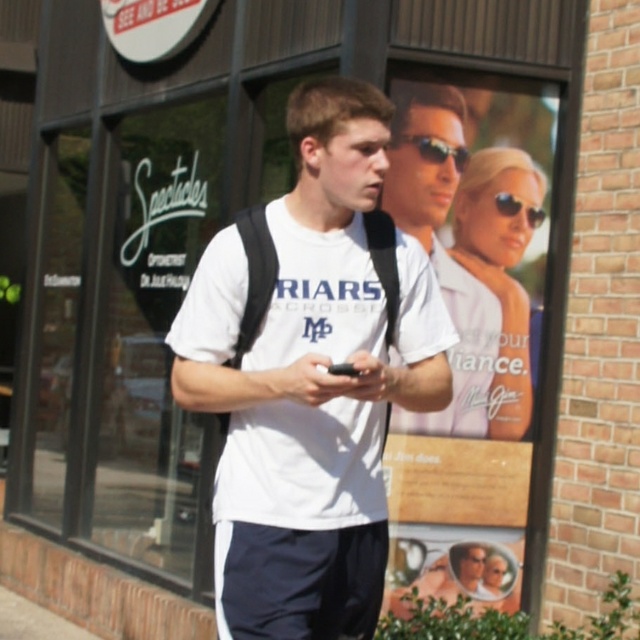
Question: Which object is the farthest from the matte white shirt at center?

Choices:
 (A) white matte t-shirt at center
 (B) black plastic sunglasses at upper center

Answer: (A)

Question: Is white matte t-shirt at center further to camera compared to black plastic sunglasses at upper center?

Choices:
 (A) yes
 (B) no

Answer: (B)

Question: Which object appears farthest from the camera in this image?

Choices:
 (A) white matte t-shirt at center
 (B) black plastic sunglasses at upper center
 (C) matte white shirt at center

Answer: (B)

Question: Which object appears closest to the camera in this image?

Choices:
 (A) black plastic sunglasses at upper center
 (B) matte white shirt at center

Answer: (B)

Question: Is white matte t-shirt at center positioned at the back of matte white shirt at center?

Choices:
 (A) no
 (B) yes

Answer: (A)

Question: Does white matte t-shirt at center have a lesser width compared to black plastic sunglasses at upper center?

Choices:
 (A) yes
 (B) no

Answer: (B)